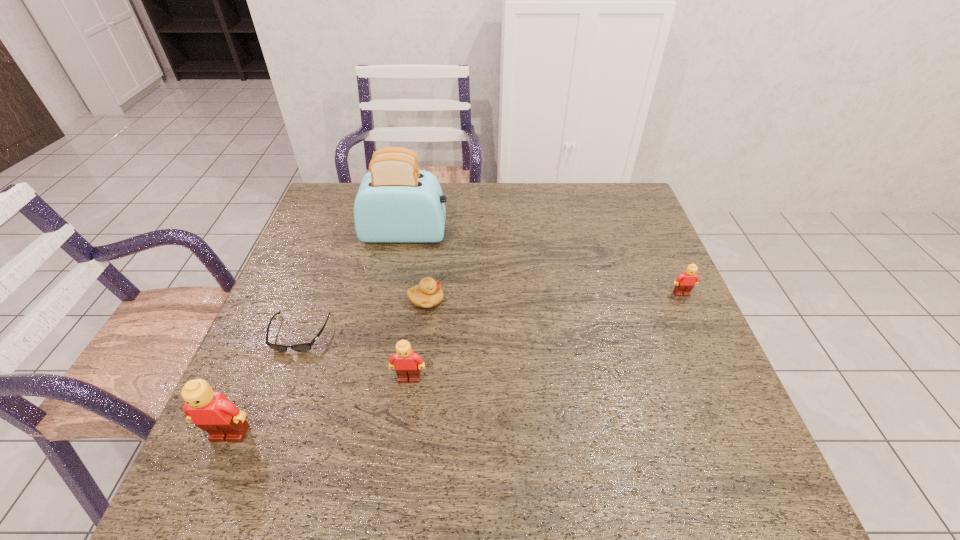
Locate an element on the screen. object situated at the right edge is located at coordinates (685, 282).

In order to click on object at the near left corner in this screenshot , I will do `click(213, 412)`.

Where is `free space at the far edge`? The width and height of the screenshot is (960, 540). free space at the far edge is located at coordinates (456, 197).

I want to click on vacant space at the left edge of the desktop, so click(x=310, y=261).

In the image, there is a desktop. Where is `vacant space at the right edge`? This screenshot has height=540, width=960. vacant space at the right edge is located at coordinates (663, 325).

In the image, there is a desktop. Where is `vacant area at the far left corner`? vacant area at the far left corner is located at coordinates (344, 188).

This screenshot has width=960, height=540. In order to click on vacant space at the far right corner of the desktop in this screenshot , I will do `click(612, 200)`.

Where is `free region at the near right corner of the desktop`? The image size is (960, 540). free region at the near right corner of the desktop is located at coordinates (734, 433).

This screenshot has width=960, height=540. What are the coordinates of `free space between the fifth farthest object and the tallest object` in the screenshot? It's located at (407, 306).

This screenshot has height=540, width=960. I want to click on free space between the rightmost object and the nearest object, so click(456, 364).